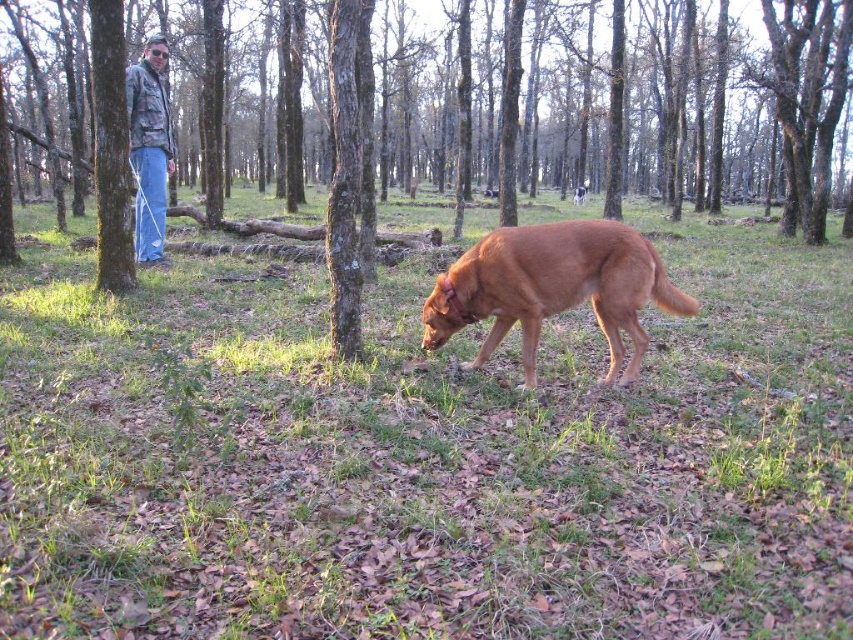
Question: Estimate the real-world distances between objects in this image. Which object is farther from the green grass at center?

Choices:
 (A) brown matte dog at center
 (B) denim jacket at left

Answer: (B)

Question: Does green grass at center lie behind brown matte dog at center?

Choices:
 (A) yes
 (B) no

Answer: (B)

Question: From the image, what is the correct spatial relationship of brown matte dog at center in relation to denim jacket at left?

Choices:
 (A) above
 (B) below

Answer: (B)

Question: Which object is farther from the camera taking this photo?

Choices:
 (A) brown matte dog at center
 (B) green grass at center

Answer: (A)

Question: Is green grass at center in front of brown matte dog at center?

Choices:
 (A) no
 (B) yes

Answer: (B)

Question: Which of these objects is positioned closest to the brown matte dog at center?

Choices:
 (A) denim jacket at left
 (B) green grass at center

Answer: (B)